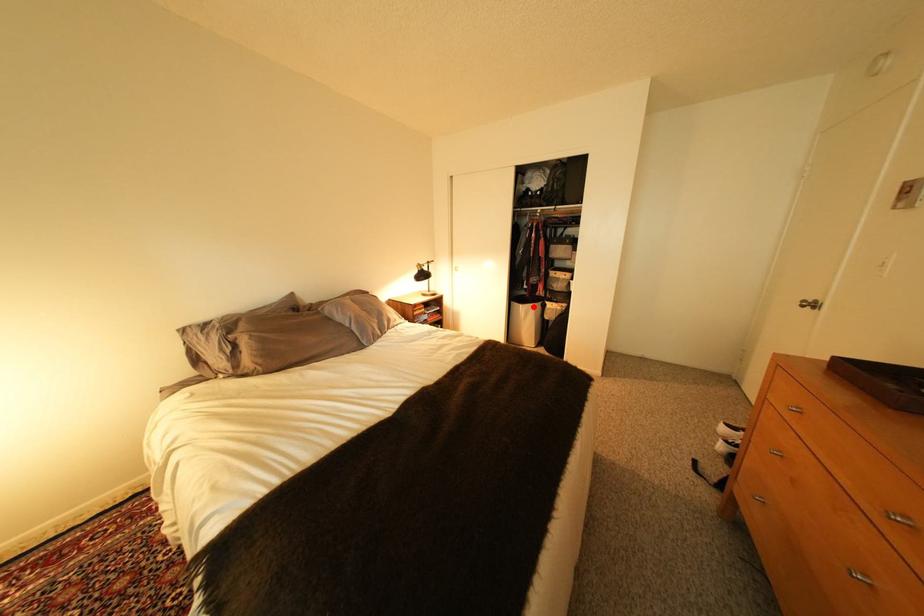
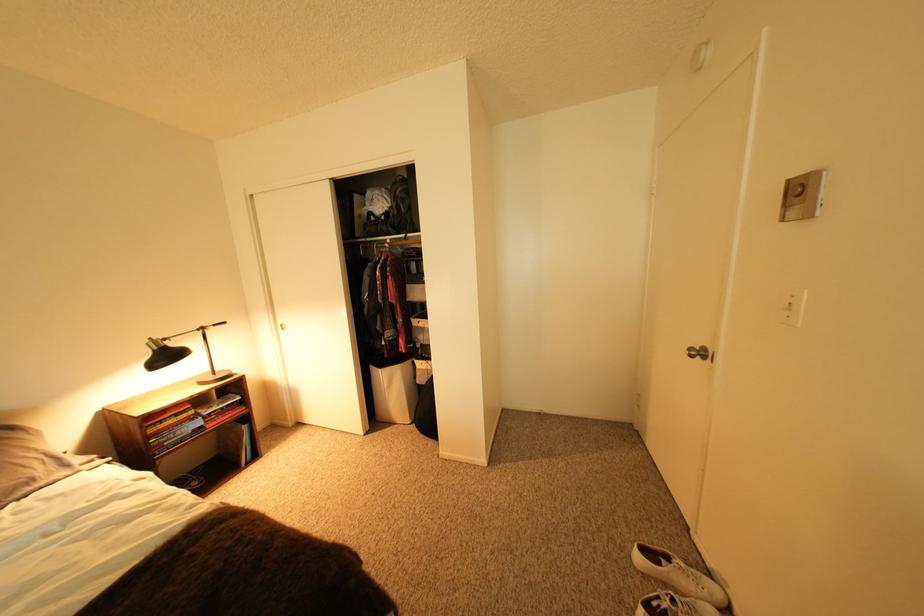
Question: I am providing you with two images of the same scene from different viewpoints. Image1 has a red point marked. In image2, the corresponding 3D location appears at what relative position? Reply with the corresponding letter.

Choices:
 (A) Closer
 (B) Farther

Answer: (B)